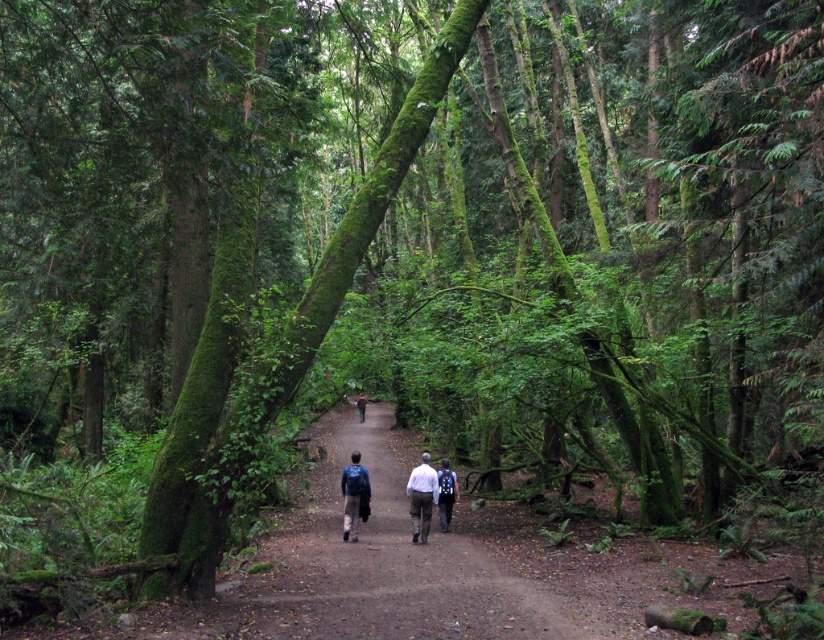
You are a hiker trying to decide whether to place your blue backpack at center on the dirt path at center. Considering the size of the path, will the backpack fit without needing to be moved later?

The dirt path at center has a larger size compared to the blue backpack at center, so the backpack will fit comfortably without needing to be moved later.

You are a hiker navigating a narrow dirt path in a dense forest. You notice two points marked on the path ahead of you. The first point is at coordinates point (279, 586) and the second is at point (456, 483). Which point should you reach first while moving forward along the path?

You should reach point (279, 586) first because it is in front of point (456, 483) along the path.